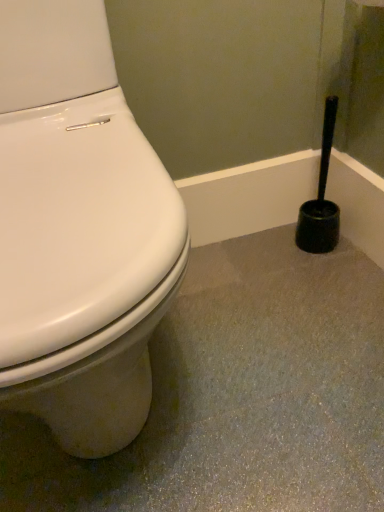
Question: Is white glossy toilet at left taller than black plastic toilet brush at right?

Choices:
 (A) yes
 (B) no

Answer: (A)

Question: Is the surface of white glossy toilet at left in direct contact with black plastic toilet brush at right?

Choices:
 (A) yes
 (B) no

Answer: (B)

Question: Can you confirm if white glossy toilet at left is thinner than black plastic toilet brush at right?

Choices:
 (A) yes
 (B) no

Answer: (B)

Question: Is white glossy toilet at left positioned far away from black plastic toilet brush at right?

Choices:
 (A) no
 (B) yes

Answer: (A)

Question: From a real-world perspective, does white glossy toilet at left stand above black plastic toilet brush at right?

Choices:
 (A) yes
 (B) no

Answer: (A)

Question: From the image's perspective, does white glossy toilet at left appear lower than black plastic toilet brush at right?

Choices:
 (A) no
 (B) yes

Answer: (B)

Question: Is black plastic toilet brush at right oriented away from white glossy toilet at left?

Choices:
 (A) yes
 (B) no

Answer: (B)

Question: Is black plastic toilet brush at right further to the viewer compared to white glossy toilet at left?

Choices:
 (A) yes
 (B) no

Answer: (A)

Question: From the image's perspective, would you say black plastic toilet brush at right is shown under white glossy toilet at left?

Choices:
 (A) no
 (B) yes

Answer: (A)

Question: Can you confirm if black plastic toilet brush at right is smaller than white glossy toilet at left?

Choices:
 (A) no
 (B) yes

Answer: (B)

Question: Would you say black plastic toilet brush at right is outside white glossy toilet at left?

Choices:
 (A) yes
 (B) no

Answer: (A)

Question: Can you see black plastic toilet brush at right touching white glossy toilet at left?

Choices:
 (A) no
 (B) yes

Answer: (A)

Question: Is black plastic toilet brush at right to the left or to the right of white glossy toilet at left in the image?

Choices:
 (A) left
 (B) right

Answer: (B)